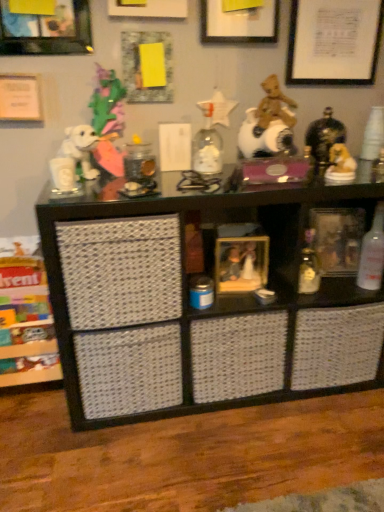
Question: From a real-world perspective, is black woven basket at center, placed as the first shelf when sorted from right to left, under wooden crate at lower left, the 1th shelf in the left-to-right sequence?

Choices:
 (A) yes
 (B) no

Answer: (B)

Question: Can you see black woven basket at center, placed as the first shelf when sorted from right to left, touching wooden crate at lower left, the 1th shelf in the left-to-right sequence?

Choices:
 (A) no
 (B) yes

Answer: (A)

Question: Does black woven basket at center, placed as the first shelf when sorted from right to left, have a greater width compared to wooden crate at lower left, the 1th shelf in the left-to-right sequence?

Choices:
 (A) yes
 (B) no

Answer: (A)

Question: Is black woven basket at center, positioned as the 2th shelf in left-to-right order, shorter than wooden crate at lower left, which is the second shelf from right to left?

Choices:
 (A) yes
 (B) no

Answer: (B)

Question: Does black woven basket at center, positioned as the 2th shelf in left-to-right order, turn towards wooden crate at lower left, the 1th shelf in the left-to-right sequence?

Choices:
 (A) no
 (B) yes

Answer: (A)

Question: Is white paper at upper center, which ranks as the second picture frame in left-to-right order, spatially inside clear glass bottle at right, or outside of it?

Choices:
 (A) outside
 (B) inside

Answer: (A)

Question: Is white paper at upper center, arranged as the 4th picture frame when viewed from the right, in front of or behind clear glass bottle at right in the image?

Choices:
 (A) behind
 (B) front

Answer: (B)

Question: From a real-world perspective, is white paper at upper center, the 1th picture frame in the top-to-bottom sequence, above or below clear glass bottle at right?

Choices:
 (A) above
 (B) below

Answer: (A)

Question: From the image's perspective, is white paper at upper center, marked as the fifth picture frame in a bottom-to-top arrangement, positioned above or below clear glass bottle at right?

Choices:
 (A) below
 (B) above

Answer: (B)

Question: Would you say brushed metal picture frame at upper left, the 1th picture frame when ordered from left to right, is to the left or to the right of white paper at upper center, which ranks as the second picture frame in left-to-right order, in the picture?

Choices:
 (A) right
 (B) left

Answer: (B)

Question: From the image's perspective, is brushed metal picture frame at upper left, which is counted as the 2th picture frame, starting from the bottom, located above or below white paper at upper center, arranged as the 4th picture frame when viewed from the right?

Choices:
 (A) below
 (B) above

Answer: (A)

Question: Is brushed metal picture frame at upper left, which is counted as the 2th picture frame, starting from the bottom, inside the boundaries of white paper at upper center, the 1th picture frame in the top-to-bottom sequence, or outside?

Choices:
 (A) outside
 (B) inside

Answer: (A)

Question: Considering the positions of brushed metal picture frame at upper left, which is counted as the 2th picture frame, starting from the bottom, and white paper at upper center, the 1th picture frame in the top-to-bottom sequence, in the image, is brushed metal picture frame at upper left, which is counted as the 2th picture frame, starting from the bottom, taller or shorter than white paper at upper center, the 1th picture frame in the top-to-bottom sequence,?

Choices:
 (A) short
 (B) tall

Answer: (B)

Question: From the image's perspective, is wooden picture frame at center, which ranks as the second picture frame in right-to-left order, positioned above or below matte white picture frame at upper center, acting as the 4th picture frame starting from the bottom?

Choices:
 (A) above
 (B) below

Answer: (B)

Question: Is wooden picture frame at center, marked as the 5th picture frame in a top-to-bottom arrangement, spatially inside matte white picture frame at upper center, the third picture frame from the right, or outside of it?

Choices:
 (A) outside
 (B) inside

Answer: (A)